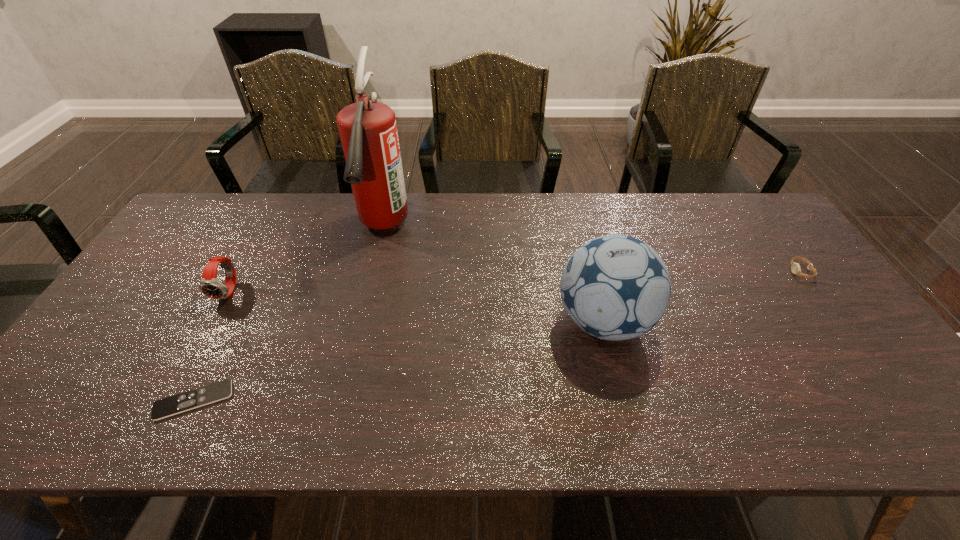
What are the coordinates of `fire extinguisher` in the screenshot? It's located at coord(368,131).

Locate an element on the screen. the third object from right to left is located at coordinates (368, 131).

The image size is (960, 540). In order to click on the second object from right to left in this screenshot , I will do (x=615, y=287).

Locate an element on the screen. the second tallest object is located at coordinates click(615, 287).

I want to click on the third shortest object, so click(x=210, y=286).

Identify the location of the taller watch. (210, 286).

Identify the location of the fourth tallest object. (795, 267).

This screenshot has width=960, height=540. What are the coordinates of `the shorter watch` in the screenshot? It's located at (795, 267).

Image resolution: width=960 pixels, height=540 pixels. What are the coordinates of `remote control` in the screenshot? It's located at (166, 407).

The image size is (960, 540). In order to click on the nearest object in this screenshot , I will do `click(166, 407)`.